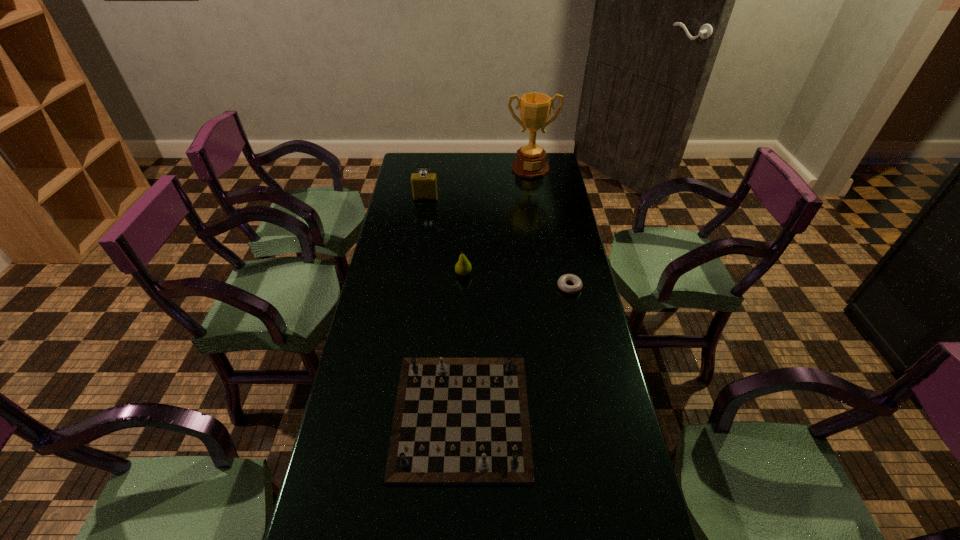
I want to click on blank space located 0.270m on the back of the pear, so click(x=466, y=223).

Locate an element on the screen. The image size is (960, 540). free region located 0.370m on the front of the doughnut is located at coordinates (590, 392).

Find the location of a particular element. object located in the far edge section of the desktop is located at coordinates (535, 108).

Find the location of a particular element. perfume at the left edge is located at coordinates tap(424, 186).

What are the coordinates of `chessboard present at the left edge` in the screenshot? It's located at (458, 421).

Locate an element on the screen. The image size is (960, 540). award present at the right edge is located at coordinates coord(535,108).

Find the location of a particular element. doughnut that is at the right edge is located at coordinates (574, 279).

Locate an element on the screen. Image resolution: width=960 pixels, height=540 pixels. object present at the far right corner is located at coordinates (535, 108).

Where is `free space at the far edge of the desktop`? Image resolution: width=960 pixels, height=540 pixels. free space at the far edge of the desktop is located at coordinates (492, 155).

Where is `free space at the left edge`? The width and height of the screenshot is (960, 540). free space at the left edge is located at coordinates (361, 327).